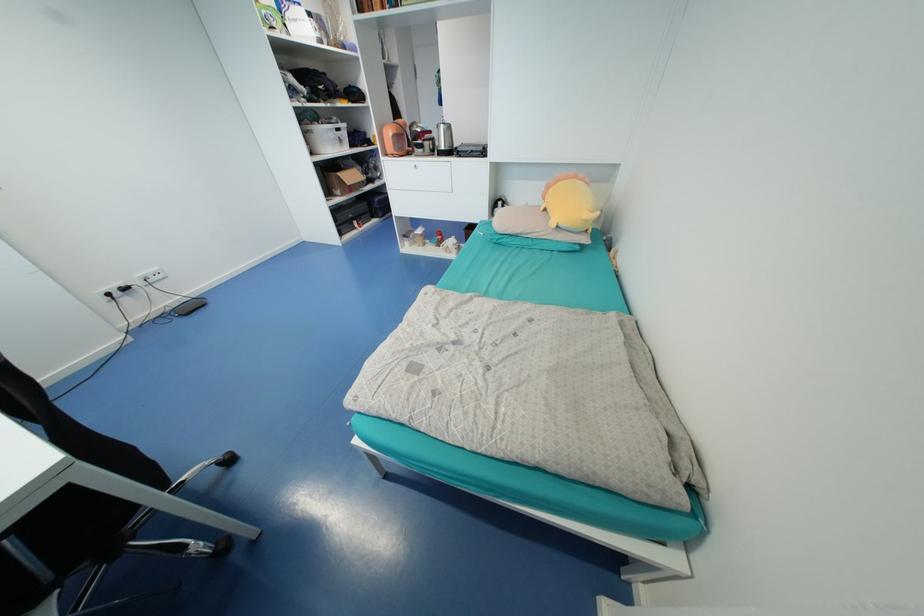
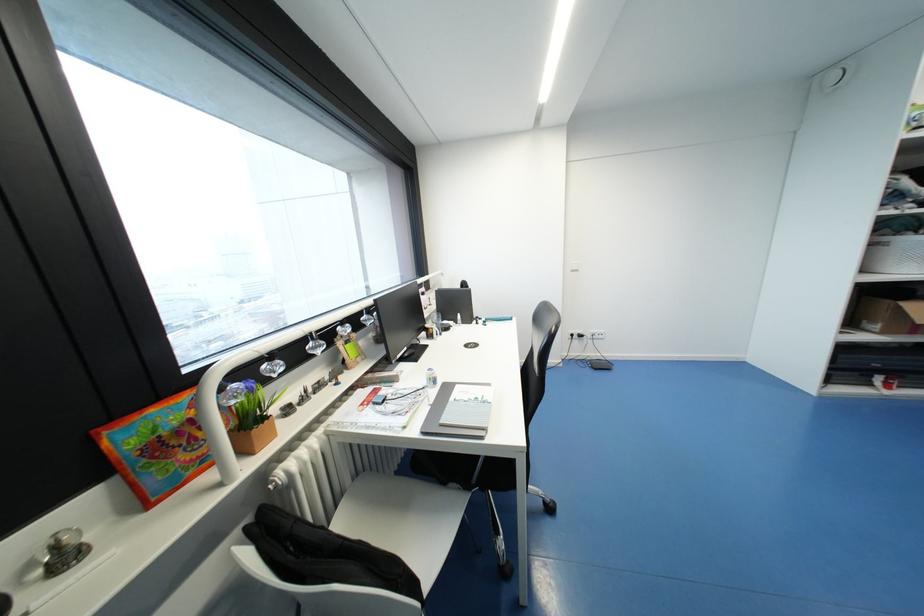
Question: The camera is either moving clockwise (left) or counter-clockwise (right) around the object. The first image is from the beginning of the video and the second image is from the end. Is the camera moving left or right when shooting the video?

Choices:
 (A) Left
 (B) Right

Answer: (B)